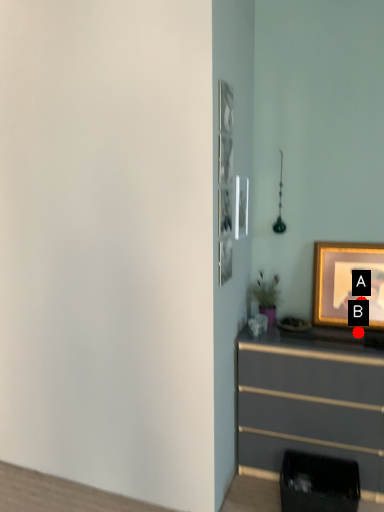
Question: Two points are circled on the image, labeled by A and B beside each circle. Which point is farther to the camera?

Choices:
 (A) A is further
 (B) B is further

Answer: (A)